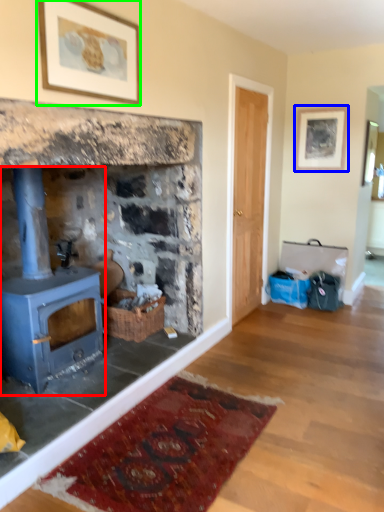
Question: Estimate the real-world distances between objects in this image. Which object is closer to wood burning stove (highlighted by a red box), picture frame (highlighted by a blue box) or picture frame (highlighted by a green box)?

Choices:
 (A) picture frame
 (B) picture frame

Answer: (B)